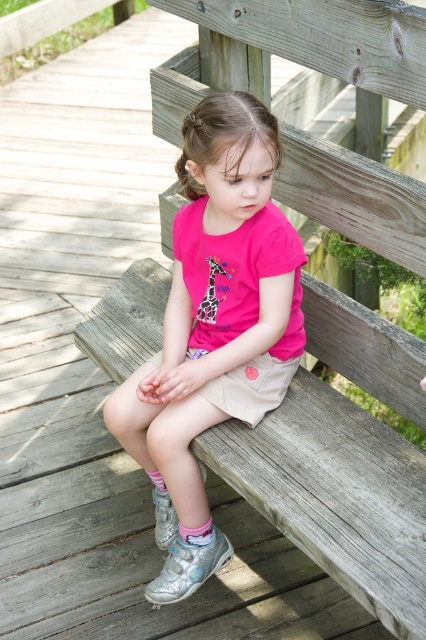
Between pink matte shirt at center and wooden bench at center, which one appears on the left side from the viewer's perspective?

pink matte shirt at center is more to the left.

Does point (253, 403) come behind point (414, 611)?

Yes, point (253, 403) is behind point (414, 611).

Where is `pink matte shirt at center`? This screenshot has height=640, width=426. pink matte shirt at center is located at coordinates (213, 326).